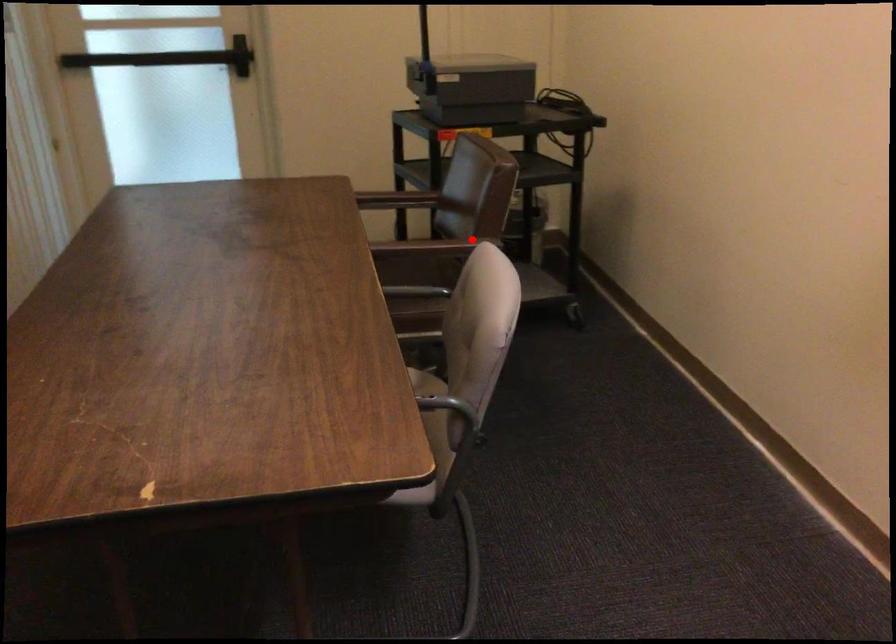
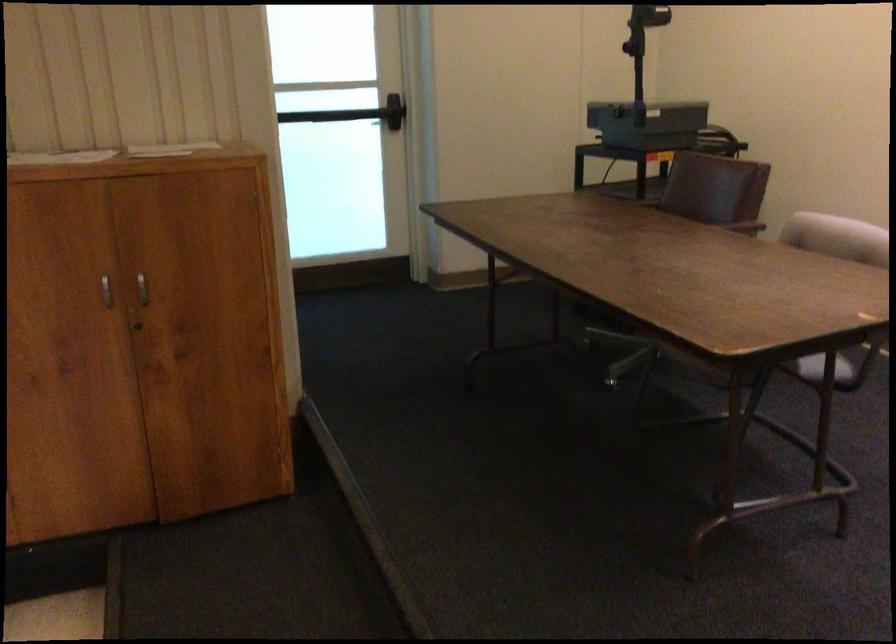
Locate, in the second image, the point that corresponds to the highlighted location in the first image.

(739, 223)